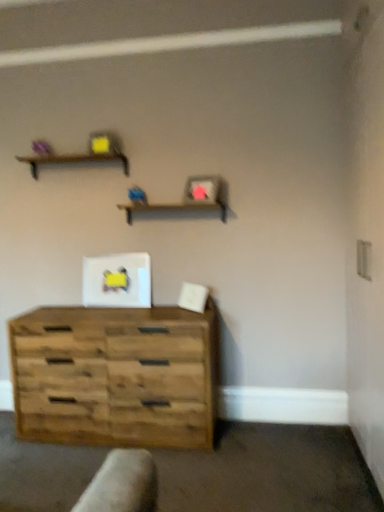
Question: Is point (132, 211) closer or farther from the camera than point (79, 157)?

Choices:
 (A) closer
 (B) farther

Answer: (B)

Question: In terms of height, does wooden shelf at center, which appears as the 2th shelf when viewed from the left, look taller or shorter compared to brown wooden shelf at upper center, the 1th shelf viewed from the left?

Choices:
 (A) short
 (B) tall

Answer: (B)

Question: Which object is the farthest from the rustic wood chest of drawers at lower left?

Choices:
 (A) brown wooden shelf at upper center, the 2th shelf from the right
 (B) wooden shelf at center, which appears as the 2th shelf when viewed from the left

Answer: (A)

Question: Which of these objects is positioned closest to the brown wooden shelf at upper center, the 2th shelf from the right?

Choices:
 (A) wooden shelf at center, which appears as the 2th shelf when viewed from the left
 (B) rustic wood chest of drawers at lower left

Answer: (A)